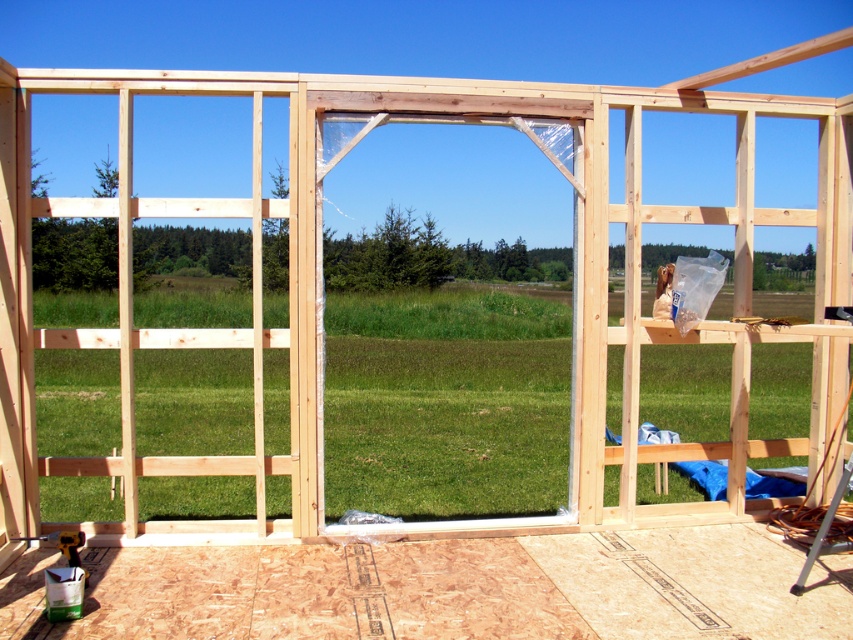
Does clear plastic window at center come behind natural wood screen door at center?

Yes, it is.

Who is more distant from viewer, (337,483) or (300,289)?

Point (337,483)

Between point (447, 497) and point (253, 432), which one is positioned behind?

Positioned behind is point (253, 432).

Find the location of `clear plastic window at center`. clear plastic window at center is located at coordinates (445, 403).